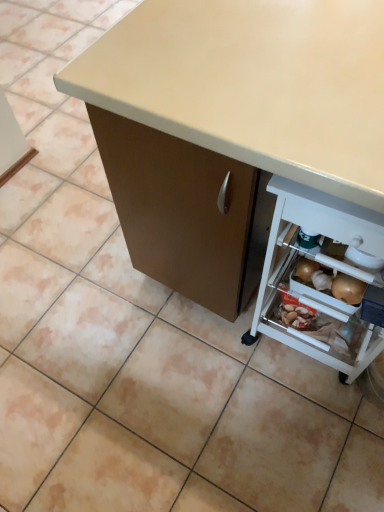
What do you see at coordinates (244, 136) in the screenshot? The width and height of the screenshot is (384, 512). I see `matte beige desk at center` at bounding box center [244, 136].

Where is `matte beige desk at center`? matte beige desk at center is located at coordinates (244, 136).

In order to face matte beige desk at center, should I rotate leftwards or rightwards?

Turn right by 13.227 degrees to look at matte beige desk at center.

What is the approximate width of matte beige desk at center?

It is 96.41 centimeters.

Where is `white plastic shelf at lower right`? The height and width of the screenshot is (512, 384). white plastic shelf at lower right is located at coordinates click(326, 288).

Describe the element at coordinates (326, 288) in the screenshot. I see `white plastic shelf at lower right` at that location.

At what (x,y) coordinates should I click in order to perform the action: click on matte beige desk at center. Please return your answer as a coordinate pair (x, y). The width and height of the screenshot is (384, 512). Looking at the image, I should click on (244, 136).

Considering the positions of objects matte beige desk at center and white plastic shelf at lower right in the image provided, who is more to the left, matte beige desk at center or white plastic shelf at lower right?

Positioned to the left is matte beige desk at center.

Is matte beige desk at center positioned behind white plastic shelf at lower right?

No, matte beige desk at center is in front of white plastic shelf at lower right.

Considering the positions of points (188, 127) and (252, 327), is point (188, 127) farther from camera compared to point (252, 327)?

No, (188, 127) is in front of (252, 327).

Looking at this image, from the image's perspective, is matte beige desk at center positioned above or below white plastic shelf at lower right?

matte beige desk at center is situated higher than white plastic shelf at lower right in the image.

From a real-world perspective, is matte beige desk at center beneath white plastic shelf at lower right?

No, from a real-world perspective, matte beige desk at center is not beneath white plastic shelf at lower right.

Which of these two, matte beige desk at center or white plastic shelf at lower right, is thinner?

With smaller width is white plastic shelf at lower right.

Is matte beige desk at center taller or shorter than white plastic shelf at lower right?

matte beige desk at center is taller than white plastic shelf at lower right.

Which of these two, matte beige desk at center or white plastic shelf at lower right, is smaller?

Smaller between the two is white plastic shelf at lower right.

Is matte beige desk at center inside the boundaries of white plastic shelf at lower right, or outside?

matte beige desk at center is not inside white plastic shelf at lower right, it's outside.

Are matte beige desk at center and white plastic shelf at lower right beside each other?

matte beige desk at center is not next to white plastic shelf at lower right, and they're not touching.

Is matte beige desk at center turned away from white plastic shelf at lower right?

That's right, matte beige desk at center is facing away from white plastic shelf at lower right.

In the image, there is a matte beige desk at center. At what (x,y) coordinates should I click in order to perform the action: click on shelf below it (from the image's perspective). Please return your answer as a coordinate pair (x, y). This screenshot has width=384, height=512. Looking at the image, I should click on (326, 288).

Does white plastic shelf at lower right appear on the left side of matte beige desk at center?

Incorrect, white plastic shelf at lower right is not on the left side of matte beige desk at center.

Considering the positions of objects white plastic shelf at lower right and matte beige desk at center in the image provided, who is in front, white plastic shelf at lower right or matte beige desk at center?

matte beige desk at center is more forward.

Considering the points (282, 193) and (294, 184), which point is behind, point (282, 193) or point (294, 184)?

The point (282, 193) is more distant.

From the image's perspective, relative to matte beige desk at center, is white plastic shelf at lower right above or below?

From the image's perspective, white plastic shelf at lower right appears below matte beige desk at center.

From a real-world perspective, which object stands above the other?

From a 3D spatial view, matte beige desk at center is above.

Which object is thinner, white plastic shelf at lower right or matte beige desk at center?

With smaller width is white plastic shelf at lower right.

Between white plastic shelf at lower right and matte beige desk at center, which one has more height?

With more height is matte beige desk at center.

Can you confirm if white plastic shelf at lower right is smaller than matte beige desk at center?

Correct, white plastic shelf at lower right occupies less space than matte beige desk at center.

Is matte beige desk at center located within white plastic shelf at lower right?

No.

Is white plastic shelf at lower right far away from matte beige desk at center?

That's not correct — white plastic shelf at lower right is a little close to matte beige desk at center.

Is white plastic shelf at lower right facing towards matte beige desk at center?

Yes, white plastic shelf at lower right is facing matte beige desk at center.

Where is `desk in front of the white plastic shelf at lower right`? desk in front of the white plastic shelf at lower right is located at coordinates [244, 136].

In the image, there is a matte beige desk at center. Where is `shelf below it (from the image's perspective)`? shelf below it (from the image's perspective) is located at coordinates [326, 288].

Locate an element on the screen. This screenshot has width=384, height=512. shelf that is behind the matte beige desk at center is located at coordinates (326, 288).